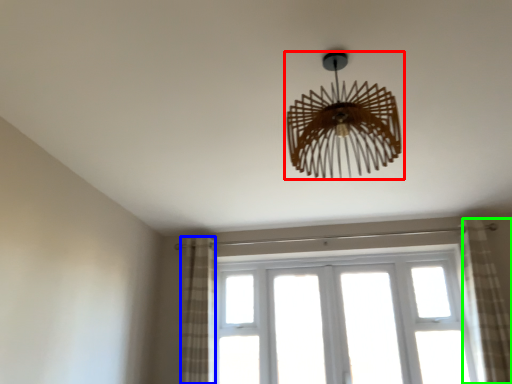
Question: Estimate the real-world distances between objects in this image. Which object is farther from lamp (highlighted by a red box), curtain (highlighted by a blue box) or curtain (highlighted by a green box)?

Choices:
 (A) curtain
 (B) curtain

Answer: (A)